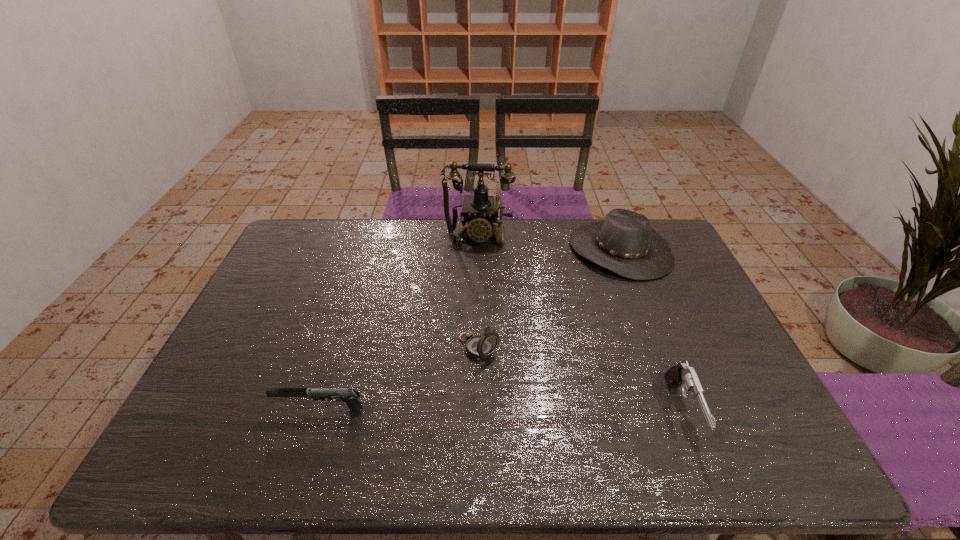
Find the location of a particular element. This screenshot has width=960, height=540. object at the far right corner is located at coordinates (624, 243).

Where is `vacant space at the far edge of the desktop`? vacant space at the far edge of the desktop is located at coordinates (416, 255).

You are a GUI agent. You are given a task and a screenshot of the screen. Output one action in this format:
    pyautogui.click(x=<x>, y=<y>)
    Task: Click on the vacant space at the near edge
    
    Given the screenshot: What is the action you would take?
    [x=532, y=395]

Identify the location of free space at the left edge. (216, 375).

Locate an element on the screen. vacant space at the right edge is located at coordinates (701, 325).

You are a GUI agent. You are given a task and a screenshot of the screen. Output one action in this format:
    pyautogui.click(x=<x>, y=<y>)
    Task: Click on the vacant area at the far left corner of the desktop
    The width and height of the screenshot is (960, 540).
    Given the screenshot: What is the action you would take?
    pyautogui.click(x=314, y=232)

Image resolution: width=960 pixels, height=540 pixels. What are the coordinates of `empty location between the taller gun and the telephone` in the screenshot? It's located at (580, 325).

Where is `free space between the telephone and the compass`? free space between the telephone and the compass is located at coordinates coord(479,293).

At what (x,y) coordinates should I click in order to perform the action: click on free space between the compass and the taller gun. Please return your answer as a coordinate pair (x, y). Looking at the image, I should click on (580, 380).

Where is `unoccupied area between the shorter gun and the compass`? This screenshot has width=960, height=540. unoccupied area between the shorter gun and the compass is located at coordinates (400, 379).